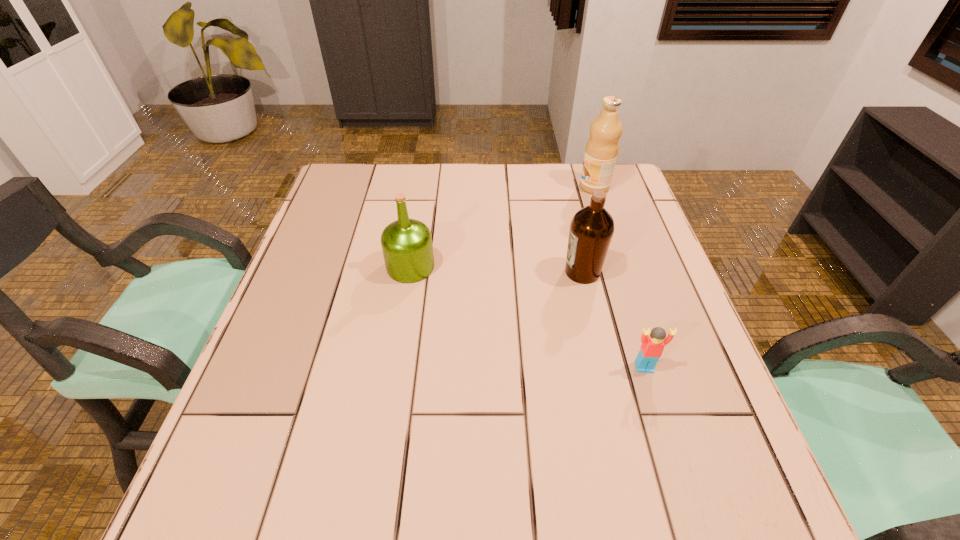
You are a GUI agent. You are given a task and a screenshot of the screen. Output one action in this format:
    pyautogui.click(x=<x>, y=<y>)
    Task: Click on the tallest olive oil
    The width and height of the screenshot is (960, 540).
    Given the screenshot: What is the action you would take?
    pyautogui.click(x=602, y=148)

Find the location of a particular element. the farthest olive oil is located at coordinates (602, 148).

The width and height of the screenshot is (960, 540). I want to click on the second object from left to right, so click(591, 230).

Find the location of a particular element. This screenshot has width=960, height=540. the leftmost object is located at coordinates (406, 243).

What are the coordinates of `Lego` in the screenshot? It's located at (652, 346).

Find the location of a particular element. This screenshot has width=960, height=540. the shortest object is located at coordinates (652, 346).

Where is `free space located 0.150m on the label of the farthest object`? free space located 0.150m on the label of the farthest object is located at coordinates (530, 187).

Find the location of a particular element. This screenshot has width=960, height=540. vacant area situated on the label of the farthest object is located at coordinates (527, 187).

Where is `free spot located 0.100m on the label of the farthest object`? free spot located 0.100m on the label of the farthest object is located at coordinates (546, 187).

Find the location of a particular element. vacant space located 0.290m on the label of the third object from right to left is located at coordinates (444, 272).